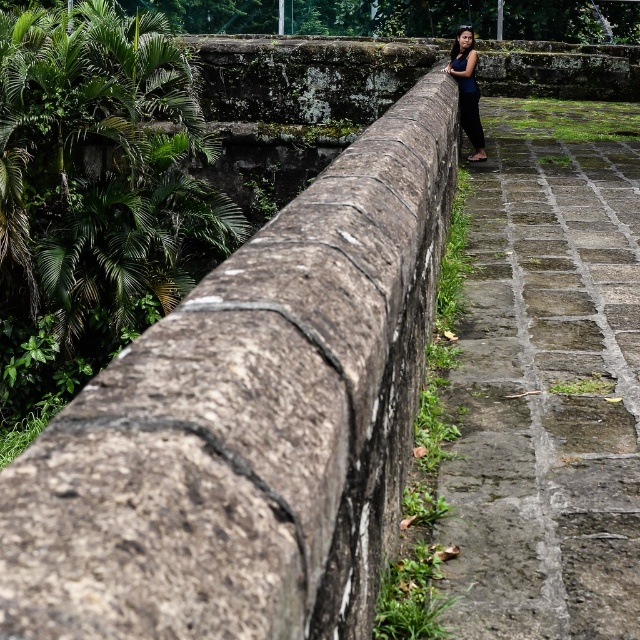
Question: Observing the image, what is the correct spatial positioning of green mossy stone at right in reference to dark blue fabric at center?

Choices:
 (A) above
 (B) below

Answer: (B)

Question: Which of the following is the closest to the observer?

Choices:
 (A) green mossy stone at right
 (B) rusty stone ledge at upper center

Answer: (B)

Question: From the image, what is the correct spatial relationship of rusty stone ledge at upper center in relation to dark blue fabric at center?

Choices:
 (A) right
 (B) left

Answer: (B)

Question: Which is nearer to the green mossy stone at right?

Choices:
 (A) rusty stone ledge at upper center
 (B) dark blue fabric at center

Answer: (A)

Question: Which of the following is the farthest from the observer?

Choices:
 (A) (476, 132)
 (B) (64, 417)
 (C) (92, 365)
 (D) (609, 321)

Answer: (C)

Question: Is rusty stone ledge at upper center to the left of dark blue fabric at center from the viewer's perspective?

Choices:
 (A) yes
 (B) no

Answer: (A)